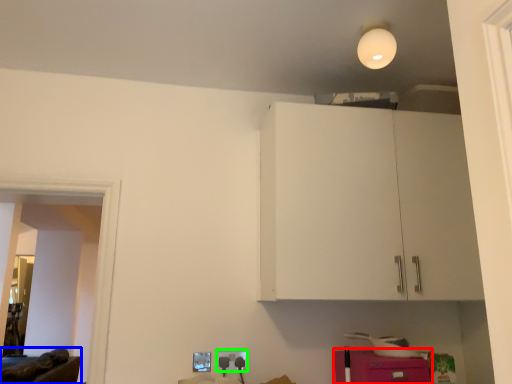
Question: Which object is positioned farthest from cabinetry (highlighted by a red box)? Select from furniture (highlighted by a blue box) and electric outlet (highlighted by a green box).

Choices:
 (A) furniture
 (B) electric outlet

Answer: (A)